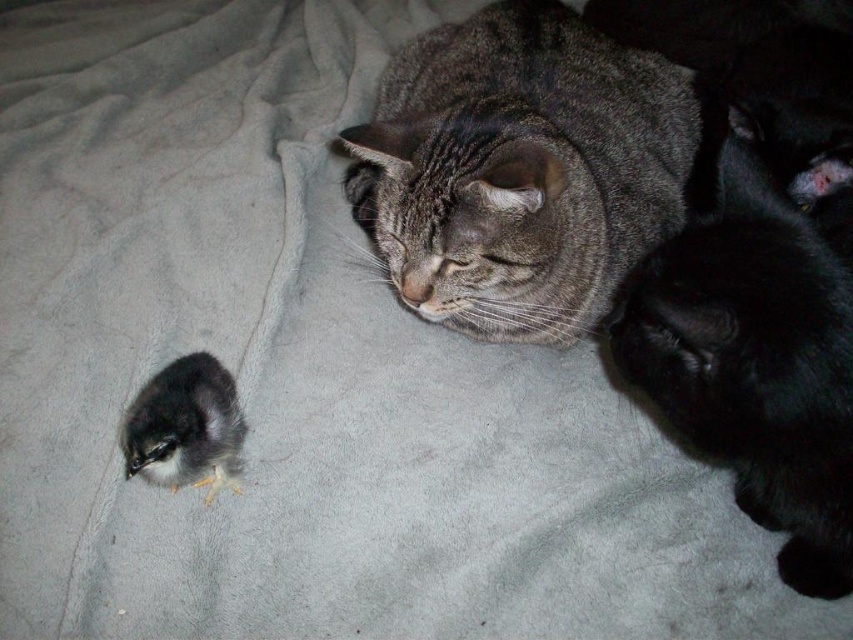
Does gray tabby cat at center have a greater height compared to silky black chick at lower left?

Yes.

Who is more forward, (602, 266) or (148, 451)?

Point (148, 451) is more forward.

Looking at this image, who is more forward, (x=405, y=253) or (x=184, y=435)?

Positioned in front is point (x=184, y=435).

Where is `gray tabby cat at center`? The image size is (853, 640). gray tabby cat at center is located at coordinates (520, 170).

Between black fur cat at right and silky black chick at lower left, which one has less height?

Standing shorter between the two is silky black chick at lower left.

Can you confirm if black fur cat at right is thinner than silky black chick at lower left?

No.

Where is `black fur cat at right`? The height and width of the screenshot is (640, 853). black fur cat at right is located at coordinates (756, 352).

Does gray tabby cat at center have a greater height compared to black fur cat at right?

In fact, gray tabby cat at center may be shorter than black fur cat at right.

Where is `gray tabby cat at center`? gray tabby cat at center is located at coordinates (520, 170).

The image size is (853, 640). In order to click on gray tabby cat at center in this screenshot , I will do pyautogui.click(x=520, y=170).

This screenshot has height=640, width=853. In order to click on gray tabby cat at center in this screenshot , I will do `click(520, 170)`.